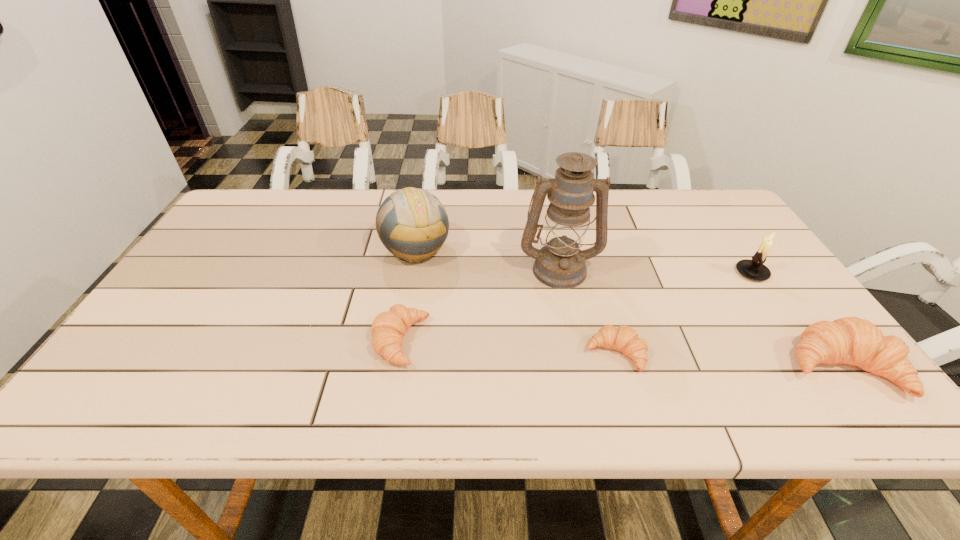
Locate an element on the screen. free space located 0.210m on the left of the shortest crescent roll is located at coordinates (492, 354).

Identify the location of free space located 0.350m on the left of the tallest crescent roll. Image resolution: width=960 pixels, height=540 pixels. (631, 367).

Locate an element on the screen. The image size is (960, 540). vacant region located on the front of the candle holder is located at coordinates (774, 305).

I want to click on vacant space located on the left of the volleyball, so click(253, 249).

In order to click on blank area located 0.400m on the left of the oil lamp in this screenshot , I will do `click(374, 269)`.

Identify the location of object that is at the far edge. The image size is (960, 540). (412, 224).

The height and width of the screenshot is (540, 960). Identify the location of crescent roll that is at the right edge. (850, 340).

I want to click on candle holder located at the right edge, so click(754, 269).

The height and width of the screenshot is (540, 960). Find the location of `object located at the near right corner`. object located at the near right corner is located at coordinates (850, 340).

Locate an element on the screen. This screenshot has width=960, height=540. vacant space at the far edge of the desktop is located at coordinates (302, 191).